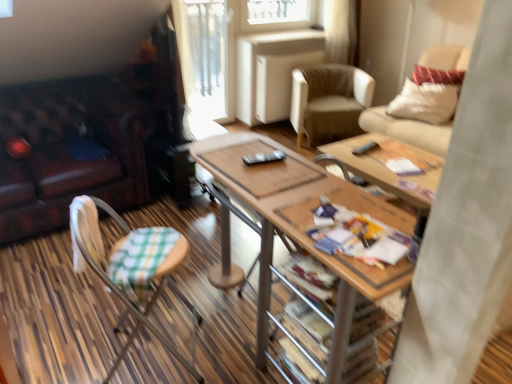
Question: From a real-world perspective, relative to beige fabric chair at upper right, placed as the second chair when sorted from bottom to top, is printed paper magazine at center vertically above or below?

Choices:
 (A) below
 (B) above

Answer: (B)

Question: Is printed paper magazine at center bigger or smaller than beige fabric chair at upper right, placed as the second chair when sorted from bottom to top?

Choices:
 (A) small
 (B) big

Answer: (A)

Question: Estimate the real-world distances between objects in this image. Which object is farther from the black plastic remote control at center, which is counted as the second remote control, starting from the front?

Choices:
 (A) leather couch at left
 (B) beige fabric chair at upper right, the 2th chair when ordered from back to front
 (C) black plastic remote control at center, the second remote control positioned from the right
 (D) beige leather armchair at center, which is counted as the second chair, starting from the left
 (E) white textured pillow at upper right

Answer: (A)

Question: Which object is the closest to the black plastic remote control at center, which is the second remote control in top-to-bottom order?

Choices:
 (A) transparent glass door at upper center
 (B) woodenmaterial/texturetable at center
 (C) black plastic remote control at center, which ranks as the 2th remote control in bottom-to-top order
 (D) printed paper magazine at center
 (E) beige leather armchair at center, arranged as the second chair when viewed from the right

Answer: (B)